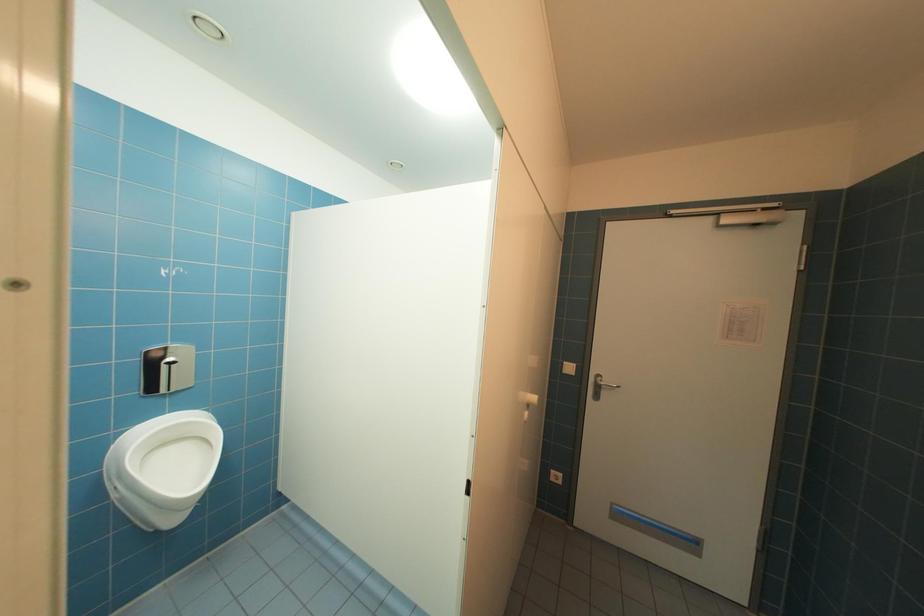
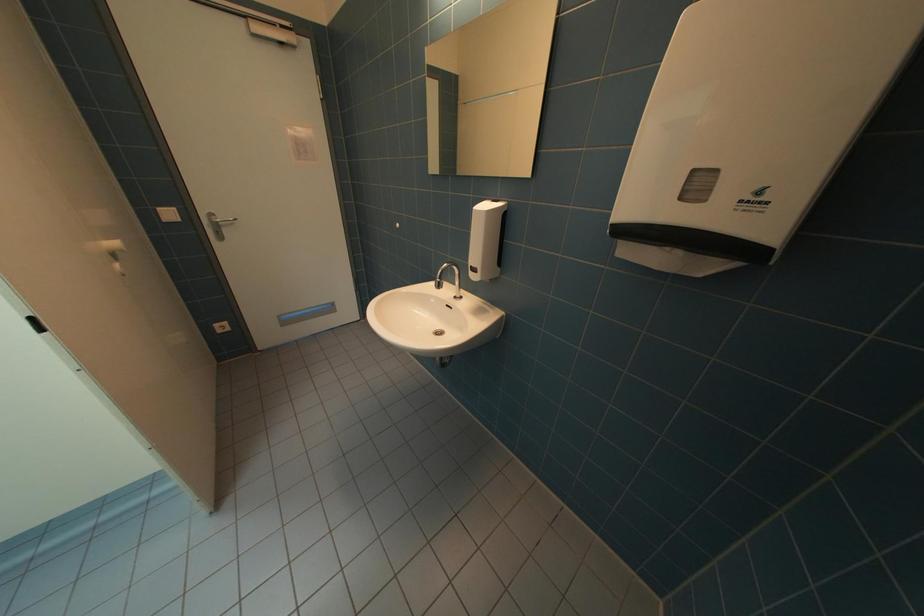
Based on the continuous images, in which direction is the camera rotating?

The rotation direction of the camera is right-down.